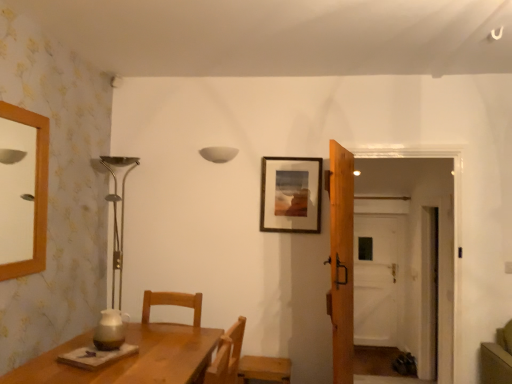
The image size is (512, 384). Describe the element at coordinates (291, 194) in the screenshot. I see `matte wooden picture frame at upper center` at that location.

Locate an element on the screen. matte wooden picture frame at upper center is located at coordinates (291, 194).

Find the location of `wooden chair at lower right`. wooden chair at lower right is located at coordinates 264,369.

What do you see at coordinates (218, 154) in the screenshot?
I see `white matte lampshade at upper center` at bounding box center [218, 154].

You are a GUI agent. You are given a task and a screenshot of the screen. Output one action in this format:
    pyautogui.click(x=<x>, y=<y>)
    Task: Click on the matte wooden picture frame at upper center
    The image size is (512, 384).
    Given the screenshot: What is the action you would take?
    pyautogui.click(x=291, y=194)

From a real-world perspective, who is located higher, wooden chair at lower right or white matte lampshade at upper center?

white matte lampshade at upper center, from a real-world perspective.

Who is smaller, wooden chair at lower right or white matte lampshade at upper center?

white matte lampshade at upper center is smaller.

Is wooden chair at lower right looking in the opposite direction of white matte lampshade at upper center?

wooden chair at lower right is not turned away from white matte lampshade at upper center.

Can you confirm if wooden chair at lower right is shorter than white matte lampshade at upper center?

Incorrect, the height of wooden chair at lower right does not fall short of that of white matte lampshade at upper center.

Which object is positioned more to the right, wooden door at center or matte wooden picture frame at upper center?

wooden door at center.

Can you confirm if wooden door at center is thinner than matte wooden picture frame at upper center?

No.

Relative to matte wooden picture frame at upper center, is wooden door at center in front or behind?

Clearly, wooden door at center is in front of matte wooden picture frame at upper center.

Is the surface of transparent glass door at center in direct contact with matte wooden picture frame at upper center?

No, transparent glass door at center is not touching matte wooden picture frame at upper center.

Is transparent glass door at center bigger or smaller than matte wooden picture frame at upper center?

transparent glass door at center is bigger than matte wooden picture frame at upper center.

Is point (368, 220) positioned behind point (295, 174)?

Yes, point (368, 220) is behind point (295, 174).

Considering the positions of objects transparent glass door at center and matte wooden picture frame at upper center in the image provided, who is behind, transparent glass door at center or matte wooden picture frame at upper center?

transparent glass door at center.

From the image's perspective, does wooden door at center appear higher than transparent glass door at center?

Yes, from the image's perspective, wooden door at center is above transparent glass door at center.

From a real-world perspective, relative to transparent glass door at center, is wooden door at center vertically above or below?

wooden door at center is situated higher than transparent glass door at center in the real world.

Looking at this image, who is shorter, wooden door at center or transparent glass door at center?

transparent glass door at center.

Would you say wooden door at center contains transparent glass door at center?

No.

From a real-world perspective, is transparent glass door at center physically above wooden chair at lower right?

Indeed, from a real-world perspective, transparent glass door at center stands above wooden chair at lower right.

Are transparent glass door at center and wooden chair at lower right making contact?

No, transparent glass door at center is not making contact with wooden chair at lower right.

Find the location of a particular element. The image size is (512, 384). chair that appears below the transparent glass door at center (from a real-world perspective) is located at coordinates (264, 369).

Based on the photo, which object is positioned more to the left, transparent glass door at center or wooden chair at lower right?

wooden chair at lower right.

Considering the sizes of wooden door at center and white matte lampshade at upper center in the image, is wooden door at center taller or shorter than white matte lampshade at upper center?

In the image, wooden door at center appears to be taller than white matte lampshade at upper center.

From a real-world perspective, which object rests below the other?

In real-world perspective, wooden door at center is lower.

Which object is further away from the camera, wooden door at center or white matte lampshade at upper center?

white matte lampshade at upper center is further from the camera.

Where is `door lying in front of the wooden chair at lower right`? door lying in front of the wooden chair at lower right is located at coordinates (341, 259).

Which of these two, wooden chair at lower right or wooden door at center, is wider?

wooden chair at lower right is wider.

Looking at this image, from the image's perspective, which object appears higher, wooden chair at lower right or wooden door at center?

From the image's view, wooden door at center is above.

Considering their positions, is wooden chair at lower right located in front of or behind wooden door at center?

wooden chair at lower right is positioned farther from the viewer than wooden door at center.

Find the location of a particular element. This screenshot has height=384, width=512. lamp above the wooden chair at lower right (from the image's perspective) is located at coordinates (218, 154).

This screenshot has width=512, height=384. Find the location of `picture frame on the left of wooden door at center`. picture frame on the left of wooden door at center is located at coordinates (291, 194).

Estimate the real-world distances between objects in this image. Which object is further from matte wooden picture frame at upper center, wooden chair at lower right or transparent glass door at center?

The object further to matte wooden picture frame at upper center is transparent glass door at center.

Based on their spatial positions, is matte wooden picture frame at upper center or wooden chair at lower right closer to transparent glass door at center?

matte wooden picture frame at upper center is positioned closer to the anchor transparent glass door at center.

Estimate the real-world distances between objects in this image. Which object is further from transparent glass door at center, white matte lampshade at upper center or wooden chair at lower right?

white matte lampshade at upper center is positioned further to the anchor transparent glass door at center.

From the image, which object appears to be farther from wooden door at center, wooden chair at lower right or matte wooden picture frame at upper center?

wooden chair at lower right lies further to wooden door at center than the other object.

Considering their positions, is wooden door at center positioned closer to white matte lampshade at upper center than matte wooden picture frame at upper center?

Among the two, matte wooden picture frame at upper center is located nearer to white matte lampshade at upper center.

When comparing their distances from white matte lampshade at upper center, does wooden door at center or transparent glass door at center seem further?

transparent glass door at center lies further to white matte lampshade at upper center than the other object.

Based on their spatial positions, is wooden chair at lower right or white matte lampshade at upper center closer to transparent glass door at center?

wooden chair at lower right lies closer to transparent glass door at center than the other object.

Considering their positions, is wooden door at center positioned further to transparent glass door at center than wooden chair at lower right?

Based on the image, wooden door at center appears to be further to transparent glass door at center.

Locate an element on the screen. The width and height of the screenshot is (512, 384). picture frame between wooden chair at lower right and transparent glass door at center along the z-axis is located at coordinates (291, 194).

You are a GUI agent. You are given a task and a screenshot of the screen. Output one action in this format:
    pyautogui.click(x=<x>, y=<y>)
    Task: Click on the chair between wooden door at center and transparent glass door at center in the front-back direction
    The width and height of the screenshot is (512, 384).
    Given the screenshot: What is the action you would take?
    pyautogui.click(x=264, y=369)

Find the location of `lamp between wooden door at center and transparent glass door at center from front to back`. lamp between wooden door at center and transparent glass door at center from front to back is located at coordinates (218, 154).

Identify the location of picture frame between white matte lampshade at upper center and wooden chair at lower right from top to bottom. This screenshot has height=384, width=512. (291, 194).